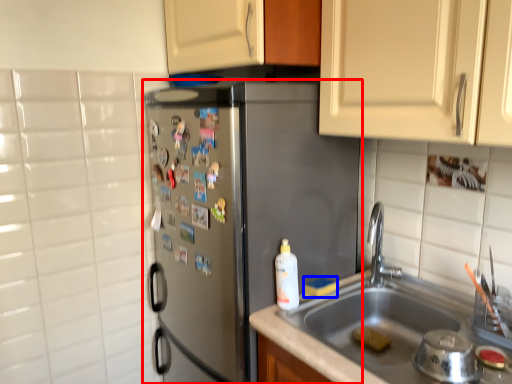
Question: Which object is closer to the camera taking this photo, refrigerator (highlighted by a red box) or food (highlighted by a blue box)?

Choices:
 (A) refrigerator
 (B) food

Answer: (A)